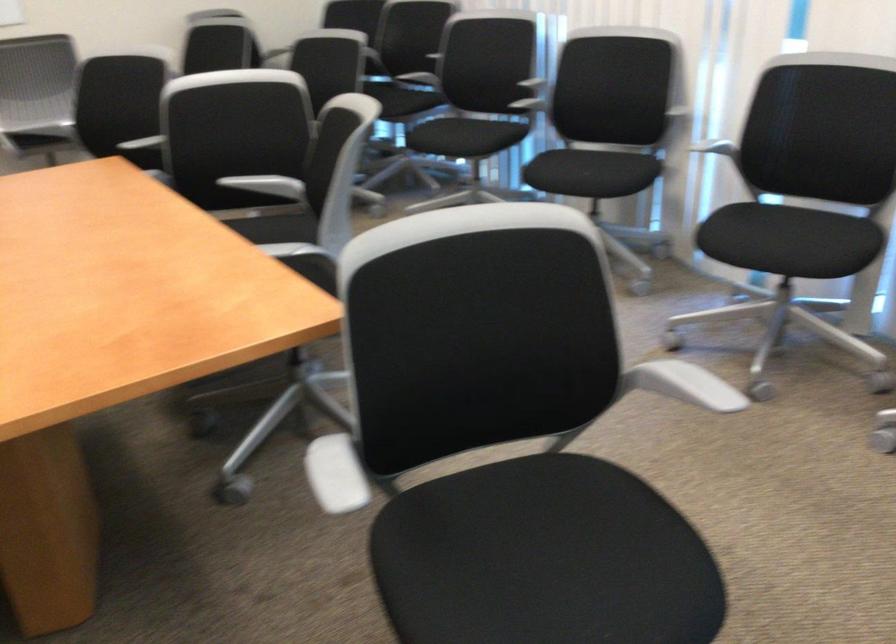
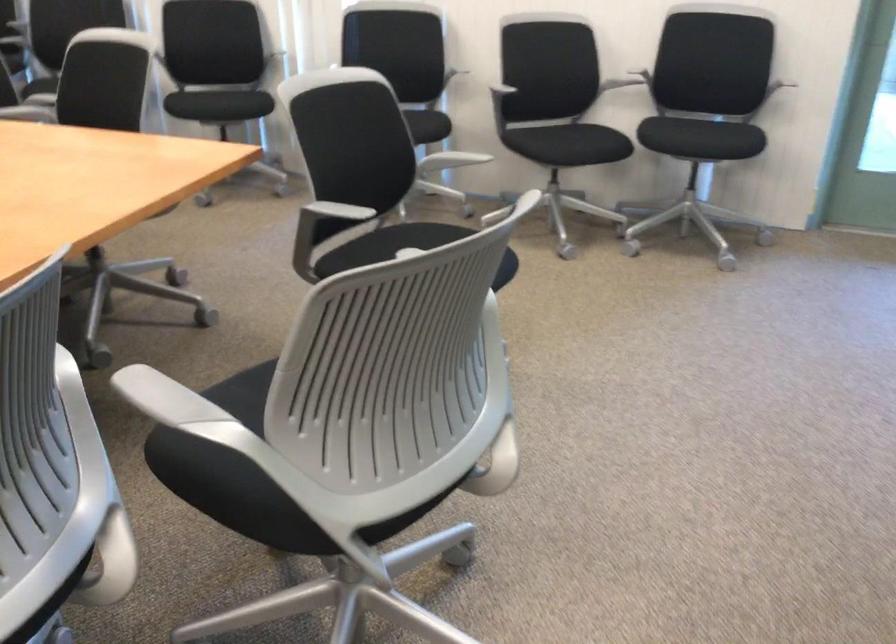
Question: I am providing you with two images of the same scene from different viewpoints. After the viewpoint changes to image2, which objects are now occluded?

Choices:
 (A) black chair sitting surface
 (B) gray adjustment knob
 (C) suitcase side handle
 (D) gray chair armrest

Answer: (A)